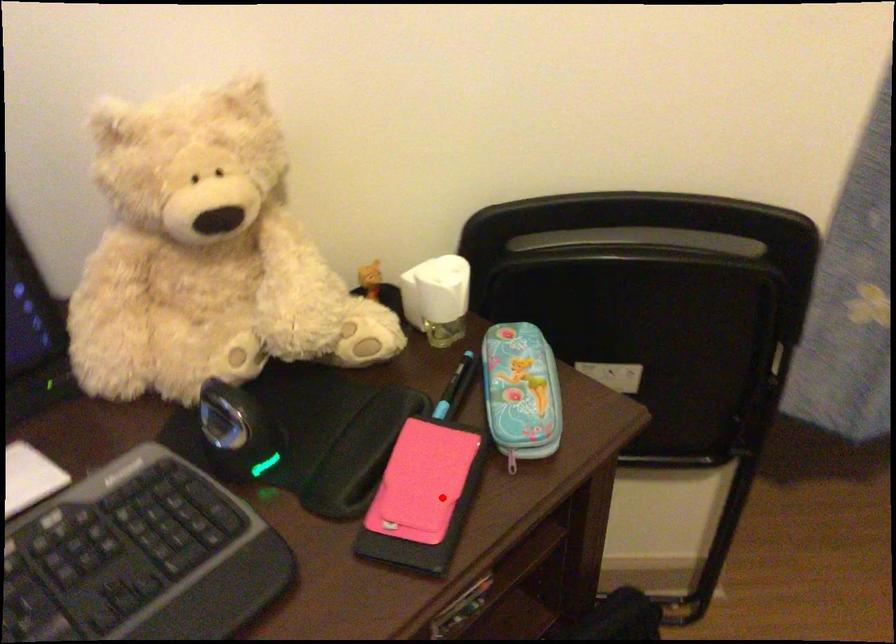
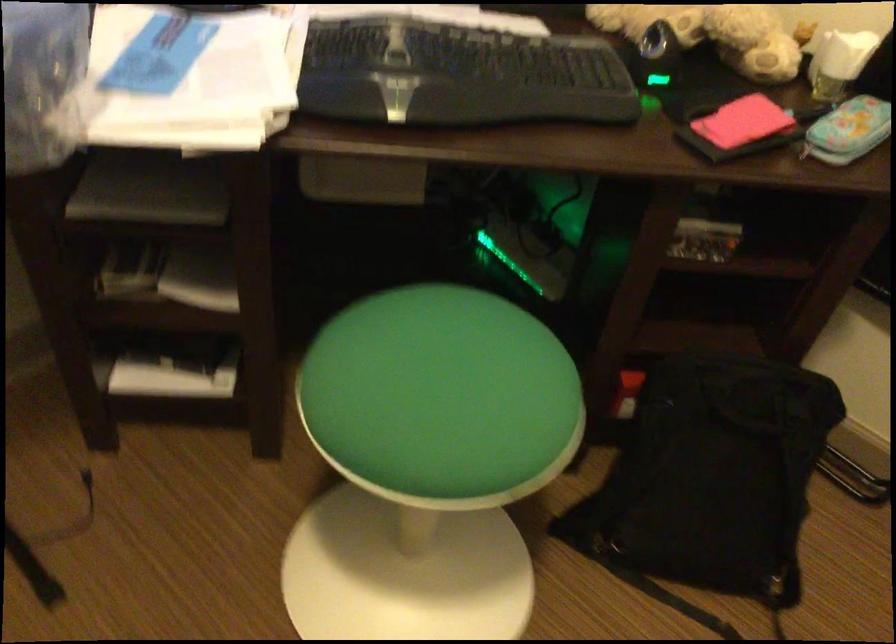
Question: I am providing you with two images of the same scene from different viewpoints. Image1 has a red point marked. In image2, the corresponding 3D location appears at what relative position? Reply with the corresponding letter.

Choices:
 (A) Closer
 (B) Farther

Answer: (B)